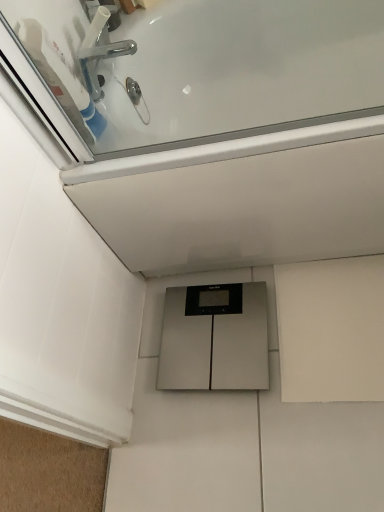
Question: Considering the positions of point (91, 39) and point (246, 42), is point (91, 39) closer or farther from the camera than point (246, 42)?

Choices:
 (A) farther
 (B) closer

Answer: (B)

Question: From their relative heights in the image, would you say chrome metallic faucet at upper left is taller or shorter than white glossy bathtub at upper center?

Choices:
 (A) tall
 (B) short

Answer: (B)

Question: Estimate the real-world distances between objects in this image. Which object is closer to the silver metallic scale at center?

Choices:
 (A) chrome metallic faucet at upper left
 (B) white glossy bathtub at upper center

Answer: (B)

Question: Considering the real-world distances, which object is farthest from the white glossy bathtub at upper center?

Choices:
 (A) chrome metallic faucet at upper left
 (B) silver metallic scale at center

Answer: (B)